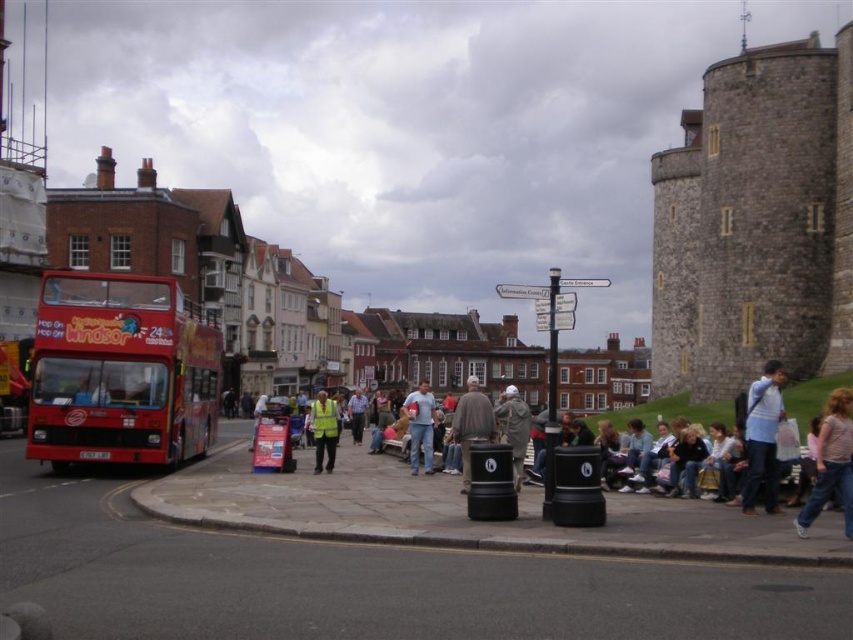
Does gray stone tower at right have a larger size compared to high visibility yellow vest at center?

Correct, gray stone tower at right is larger in size than high visibility yellow vest at center.

Does gray stone tower at right appear on the right side of high visibility yellow vest at center?

Correct, you'll find gray stone tower at right to the right of high visibility yellow vest at center.

The width and height of the screenshot is (853, 640). What are the coordinates of `gray stone tower at right` in the screenshot? It's located at (756, 221).

Is pink fabric shirt at lower right to the right of gray fabric jacket at center from the viewer's perspective?

Yes, pink fabric shirt at lower right is to the right of gray fabric jacket at center.

Which is below, pink fabric shirt at lower right or gray fabric jacket at center?

Positioned lower is gray fabric jacket at center.

Who is more distant from viewer, (834,424) or (489,406)?

The point (489,406) is more distant.

Image resolution: width=853 pixels, height=640 pixels. In order to click on pink fabric shirt at lower right in this screenshot , I will do `click(831, 461)`.

Is blue fabric jacket at lower right positioned at the back of denim jeans at center?

No, blue fabric jacket at lower right is closer to the viewer.

Between point (779, 396) and point (413, 461), which one is positioned in front?

Positioned in front is point (779, 396).

Locate an element on the screen. The height and width of the screenshot is (640, 853). blue fabric jacket at lower right is located at coordinates (762, 435).